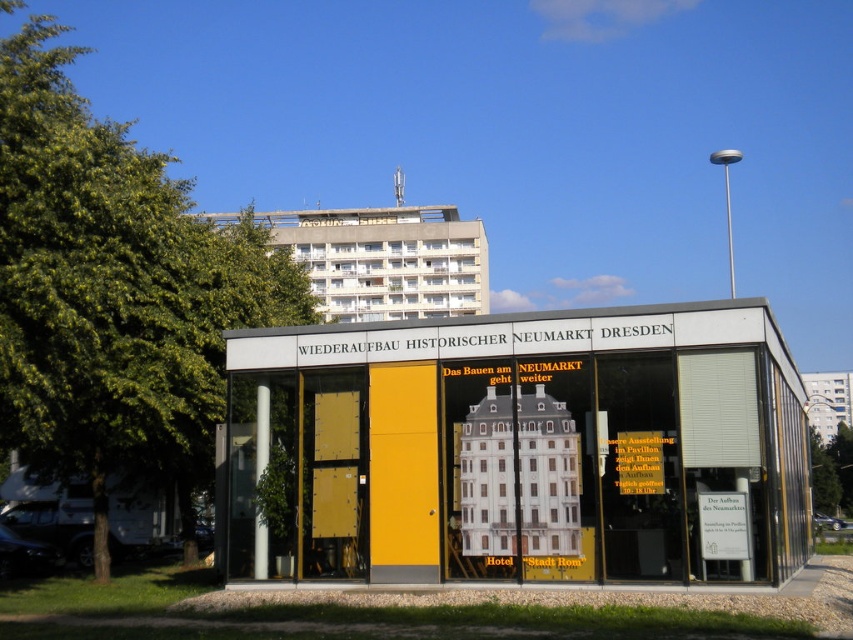
You are standing in front of the modern building with the glass facade and see the green leafy tree at left and the green leafy tree at lower right. Which tree is located more to the left?

The green leafy tree at left is positioned on the left side of the green leafy tree at lower right, so it is more to the left.

You are an architect designing a new park layout. You need to place a bench between the green leafy tree at lower right and the green leafy tree at upper left. Based on their widths, which tree should the bench be closer to?

The bench should be placed closer to the green leafy tree at upper left because the green leafy tree at lower right might be wider, requiring more space around it.